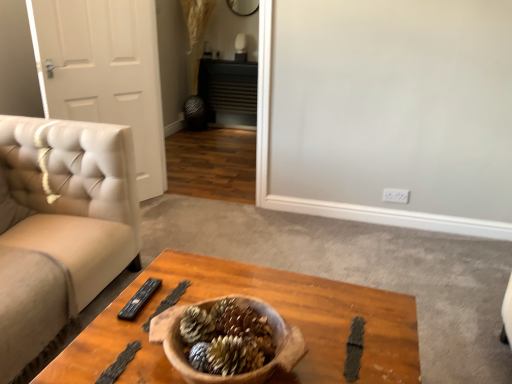
Question: From a real-world perspective, is wooden coffee table at center physically above white leather door at left?

Choices:
 (A) yes
 (B) no

Answer: (B)

Question: From a real-world perspective, is wooden coffee table at center beneath white leather door at left?

Choices:
 (A) yes
 (B) no

Answer: (A)

Question: Can you confirm if wooden coffee table at center is taller than white leather door at left?

Choices:
 (A) no
 (B) yes

Answer: (A)

Question: Considering the relative sizes of wooden coffee table at center and white leather door at left in the image provided, is wooden coffee table at center wider than white leather door at left?

Choices:
 (A) no
 (B) yes

Answer: (B)

Question: Is wooden coffee table at center smaller than white leather door at left?

Choices:
 (A) yes
 (B) no

Answer: (B)

Question: From the image's perspective, is black plastic remote at center located above or below wooden coffee table at center?

Choices:
 (A) above
 (B) below

Answer: (A)

Question: Is black plastic remote at center wider or thinner than wooden coffee table at center?

Choices:
 (A) thin
 (B) wide

Answer: (A)

Question: Is point coord(144,284) positioned closer to the camera than point coord(79,350)?

Choices:
 (A) closer
 (B) farther

Answer: (B)

Question: Is black plastic remote at center inside the boundaries of wooden coffee table at center, or outside?

Choices:
 (A) inside
 (B) outside

Answer: (A)

Question: In terms of size, does wooden coffee table at center appear bigger or smaller than white leather door at left?

Choices:
 (A) big
 (B) small

Answer: (A)

Question: Relative to white leather door at left, is wooden coffee table at center in front or behind?

Choices:
 (A) behind
 (B) front

Answer: (B)

Question: From the image's perspective, relative to white leather door at left, is wooden coffee table at center above or below?

Choices:
 (A) above
 (B) below

Answer: (B)

Question: Which is correct: wooden coffee table at center is inside white leather door at left, or outside of it?

Choices:
 (A) inside
 (B) outside

Answer: (B)

Question: Considering the positions of white leather door at left and black plastic remote at center in the image, is white leather door at left wider or thinner than black plastic remote at center?

Choices:
 (A) thin
 (B) wide

Answer: (A)

Question: Considering the positions of white leather door at left and black plastic remote at center in the image, is white leather door at left bigger or smaller than black plastic remote at center?

Choices:
 (A) small
 (B) big

Answer: (B)